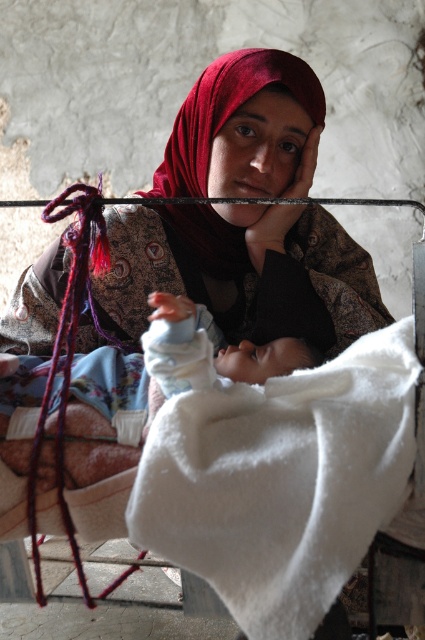
Question: Can you confirm if white fluffy blanket at center is positioned below light blue fabric at center?

Choices:
 (A) no
 (B) yes

Answer: (B)

Question: Which of the following is the farthest from the observer?

Choices:
 (A) (277, 346)
 (B) (229, 518)
 (C) (207, 131)

Answer: (C)

Question: Does white fluffy blanket at center appear on the right side of light blue fabric at center?

Choices:
 (A) no
 (B) yes

Answer: (B)

Question: Considering the real-world distances, which object is closest to the velvet red headscarf at center?

Choices:
 (A) white fluffy blanket at center
 (B) light blue fabric at center

Answer: (B)

Question: Can you confirm if velvet red headscarf at center is bigger than light blue fabric at center?

Choices:
 (A) yes
 (B) no

Answer: (A)

Question: Which of the following is the farthest from the observer?

Choices:
 (A) (138, 484)
 (B) (226, 276)
 (C) (189, 378)

Answer: (B)